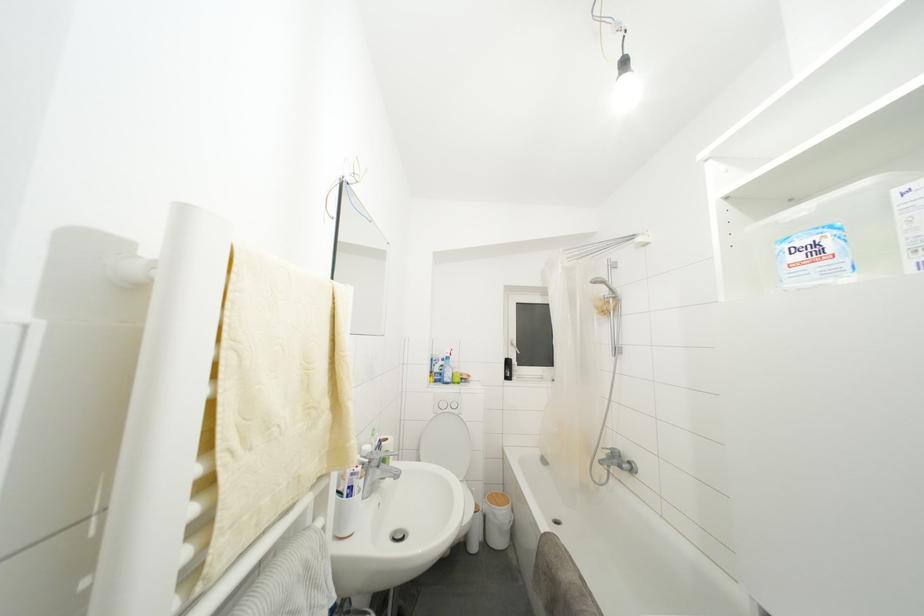
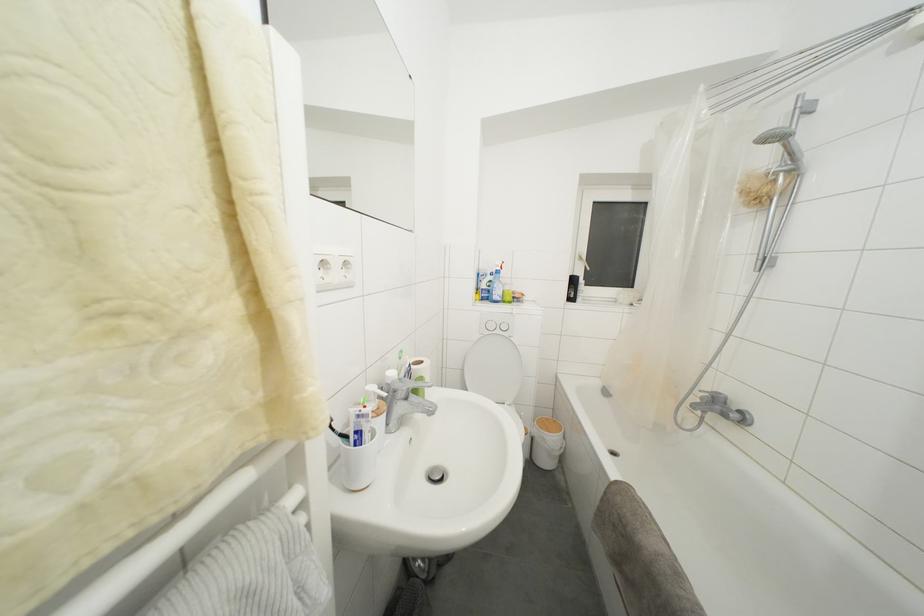
The point at (546, 536) is marked in the first image. Where is the corresponding point in the second image?

(617, 484)